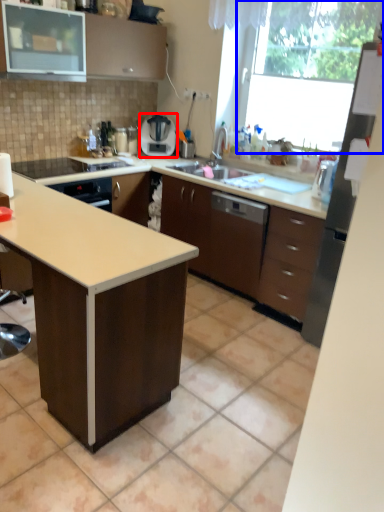
Question: Which of the following is the farthest to the observer, home appliance (highlighted by a red box) or window screen (highlighted by a blue box)?

Choices:
 (A) home appliance
 (B) window screen

Answer: (A)